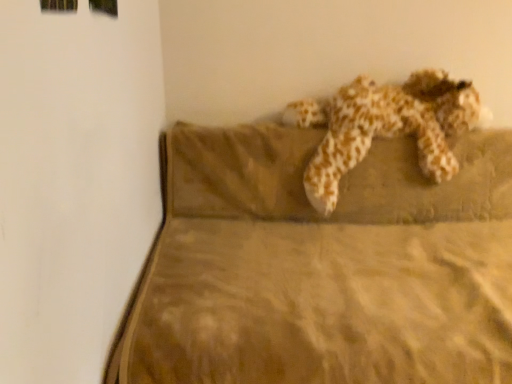
Question: Looking at their shapes, would you say brown velvety mattress at upper right is wider or thinner than fluffy beige stuffed animal at center?

Choices:
 (A) thin
 (B) wide

Answer: (B)

Question: Considering the positions of point (510, 216) and point (327, 200), is point (510, 216) closer or farther from the camera than point (327, 200)?

Choices:
 (A) farther
 (B) closer

Answer: (A)

Question: From a real-world perspective, is brown velvety mattress at upper right above or below fluffy beige stuffed animal at center?

Choices:
 (A) above
 (B) below

Answer: (B)

Question: Considering their positions, is fluffy beige stuffed animal at center located in front of or behind brown velvety mattress at upper right?

Choices:
 (A) behind
 (B) front

Answer: (A)

Question: From a real-world perspective, relative to brown velvety mattress at upper right, is fluffy beige stuffed animal at center vertically above or below?

Choices:
 (A) above
 (B) below

Answer: (A)

Question: From the image's perspective, relative to brown velvety mattress at upper right, is fluffy beige stuffed animal at center above or below?

Choices:
 (A) above
 (B) below

Answer: (A)

Question: Is fluffy beige stuffed animal at center wider or thinner than brown velvety mattress at upper right?

Choices:
 (A) wide
 (B) thin

Answer: (B)